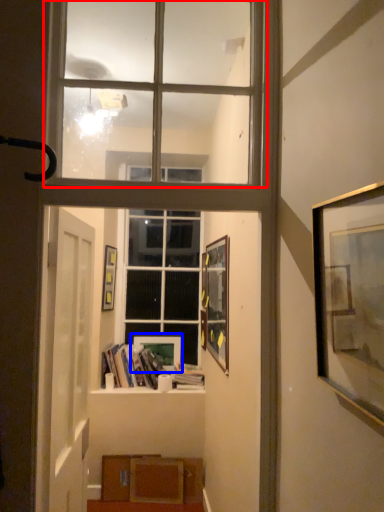
Question: Which of the following is the closest to the observer, window (highlighted by a red box) or picture frame (highlighted by a blue box)?

Choices:
 (A) window
 (B) picture frame

Answer: (A)